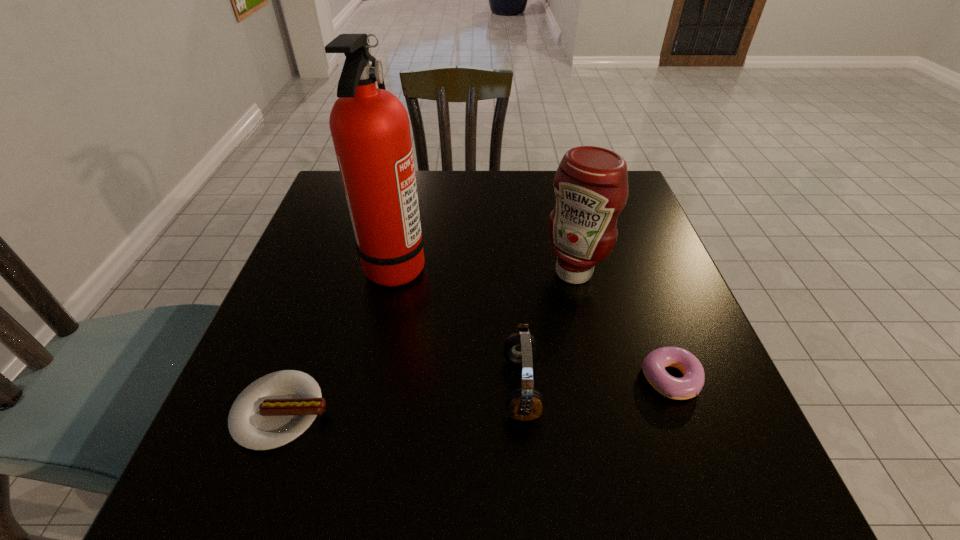
Locate an element on the screen. The height and width of the screenshot is (540, 960). free region located on the ear cups of the third object from right to left is located at coordinates (475, 388).

Locate an element on the screen. The image size is (960, 540). free location located on the ear cups of the third object from right to left is located at coordinates (355, 388).

The width and height of the screenshot is (960, 540). In order to click on free space located on the back of the rightmost object in this screenshot , I will do `click(621, 247)`.

Find the location of `vacant space located 0.080m on the front of the sausage`. vacant space located 0.080m on the front of the sausage is located at coordinates (247, 509).

I want to click on object present at the near edge, so click(274, 410).

What are the coordinates of `object present at the left edge` in the screenshot? It's located at (274, 410).

In order to click on condiment that is positioned at the right edge in this screenshot , I will do `click(591, 183)`.

Image resolution: width=960 pixels, height=540 pixels. In order to click on doughnut located in the right edge section of the desktop in this screenshot , I will do `click(654, 364)`.

Where is `object positioned at the near left corner`? object positioned at the near left corner is located at coordinates (274, 410).

Locate an element on the screen. The height and width of the screenshot is (540, 960). vacant space at the far edge of the desktop is located at coordinates (525, 191).